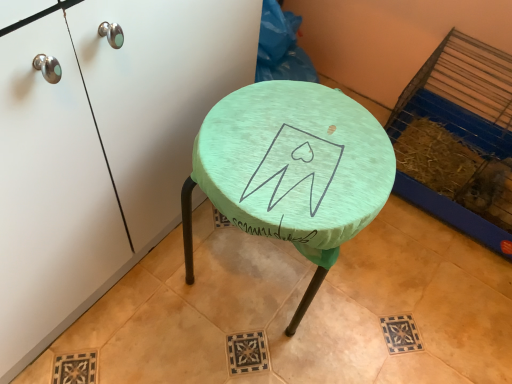
Locate an element on the screen. The image size is (512, 384). free spot in front of teal fabric stool at center is located at coordinates (229, 354).